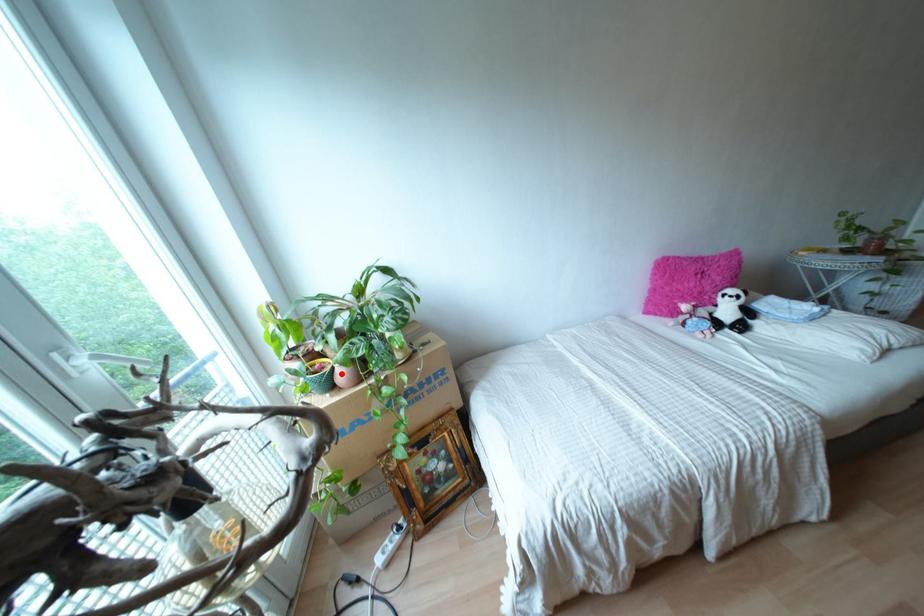
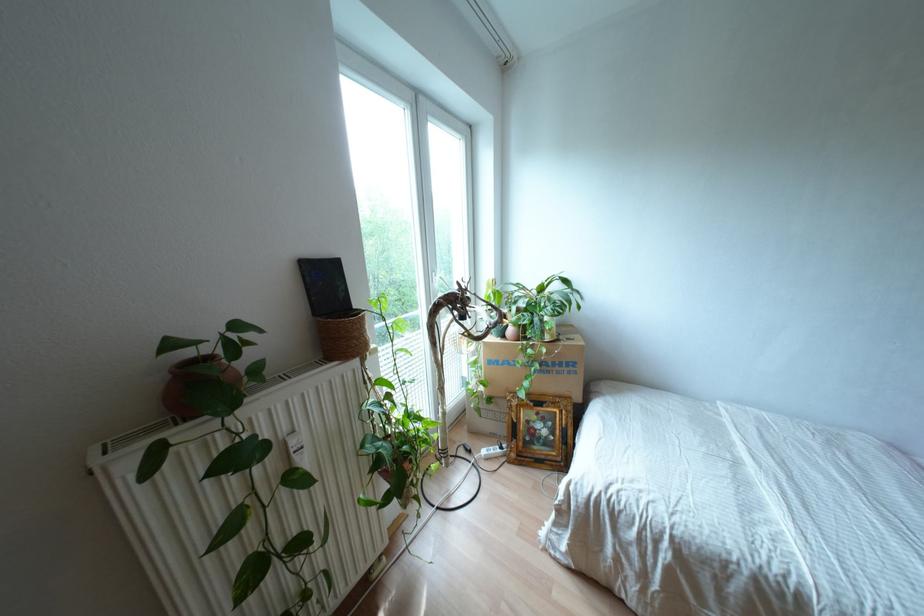
Question: A red point is marked in image1. In image2, is the corresponding 3D point closer to the camera or farther? Reply with the corresponding letter.

Choices:
 (A) The corresponding 3D point is closer.
 (B) The corresponding 3D point is farther.

Answer: (B)